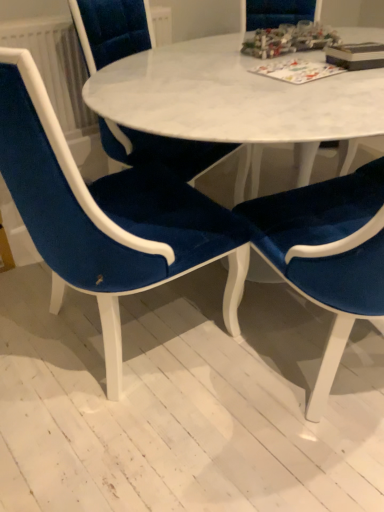
Question: From a real-world perspective, does white textured radiator at upper left sit lower than matte paper board game at upper center, the 2th book from the right?

Choices:
 (A) yes
 (B) no

Answer: (A)

Question: Is the depth of white textured radiator at upper left greater than that of matte paper board game at upper center, acting as the first book starting from the left?

Choices:
 (A) yes
 (B) no

Answer: (A)

Question: Would you say white textured radiator at upper left is a long distance from matte paper board game at upper center, the 2th book from the right?

Choices:
 (A) no
 (B) yes

Answer: (A)

Question: From the image's perspective, would you say white textured radiator at upper left is shown under matte paper board game at upper center, the 2th book from the right?

Choices:
 (A) yes
 (B) no

Answer: (B)

Question: Is matte paper board game at upper center, the 2th book from the right, a part of white textured radiator at upper left?

Choices:
 (A) no
 (B) yes

Answer: (A)

Question: From the image's perspective, does white textured radiator at upper left appear higher than matte paper board game at upper center, acting as the first book starting from the left?

Choices:
 (A) no
 (B) yes

Answer: (B)

Question: Is velvet blue chair at lower left, which is the 1th chair from left to right, facing away from velvet blue chair at center, which ranks as the 1th chair in right-to-left order?

Choices:
 (A) no
 (B) yes

Answer: (A)

Question: Does velvet blue chair at lower left, which is the 1th chair from left to right, appear on the right side of velvet blue chair at center, the third chair positioned from the left?

Choices:
 (A) no
 (B) yes

Answer: (A)

Question: Is velvet blue chair at lower left, which is the 1th chair from left to right, not close to velvet blue chair at center, which ranks as the 1th chair in right-to-left order?

Choices:
 (A) yes
 (B) no

Answer: (B)

Question: Does velvet blue chair at lower left, which is the 1th chair from left to right, have a larger size compared to velvet blue chair at center, which ranks as the 1th chair in right-to-left order?

Choices:
 (A) yes
 (B) no

Answer: (A)

Question: Can you confirm if velvet blue chair at lower left, the 3th chair in the right-to-left sequence, is positioned to the left of velvet blue chair at center, which ranks as the 1th chair in right-to-left order?

Choices:
 (A) yes
 (B) no

Answer: (A)

Question: Could you tell me if velvet blue chair at lower left, the 3th chair in the right-to-left sequence, is facing velvet blue chair at center, which ranks as the 1th chair in right-to-left order?

Choices:
 (A) no
 (B) yes

Answer: (A)

Question: Is matte paper board game at upper center, acting as the first book starting from the left, located outside velvet blue chair at center, the 2th chair viewed from the right?

Choices:
 (A) yes
 (B) no

Answer: (A)